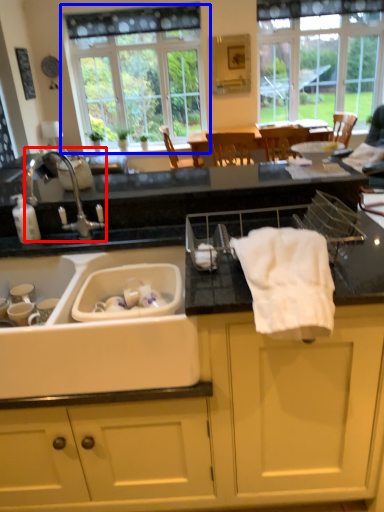
Question: Which of the following is the farthest to the observer, tap (highlighted by a red box) or window (highlighted by a blue box)?

Choices:
 (A) tap
 (B) window

Answer: (B)